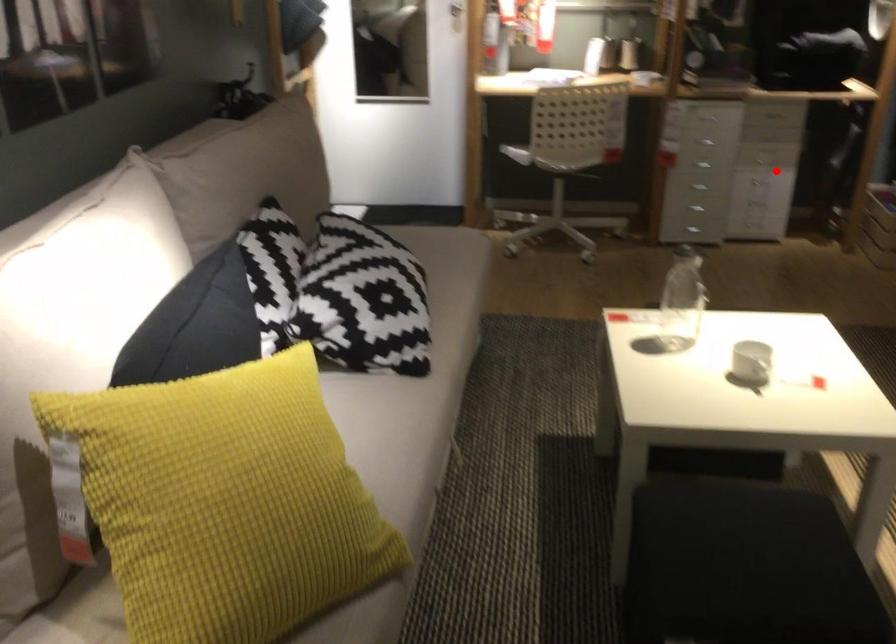
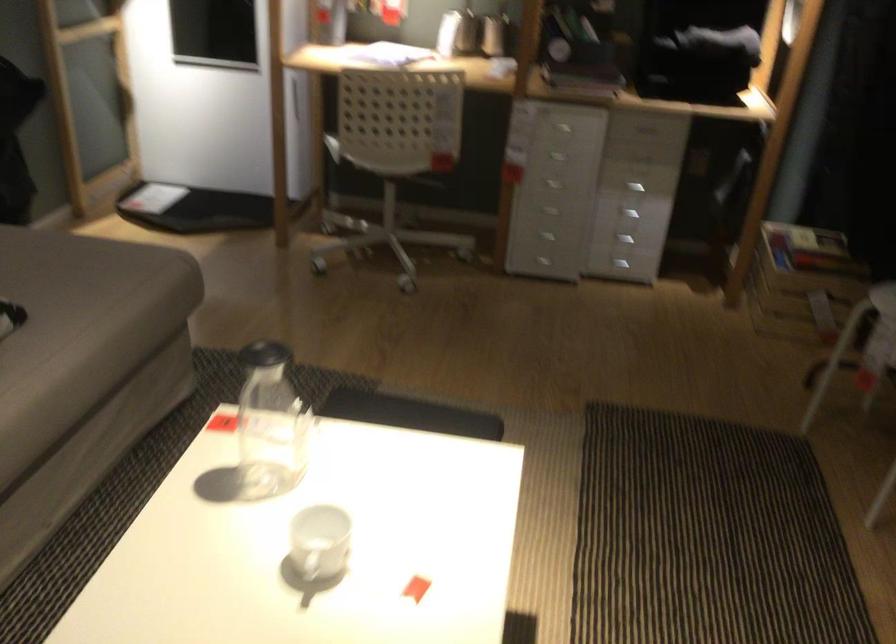
The point at the highlighted location is marked in the first image. Where is the corresponding point in the second image?

(627, 214)